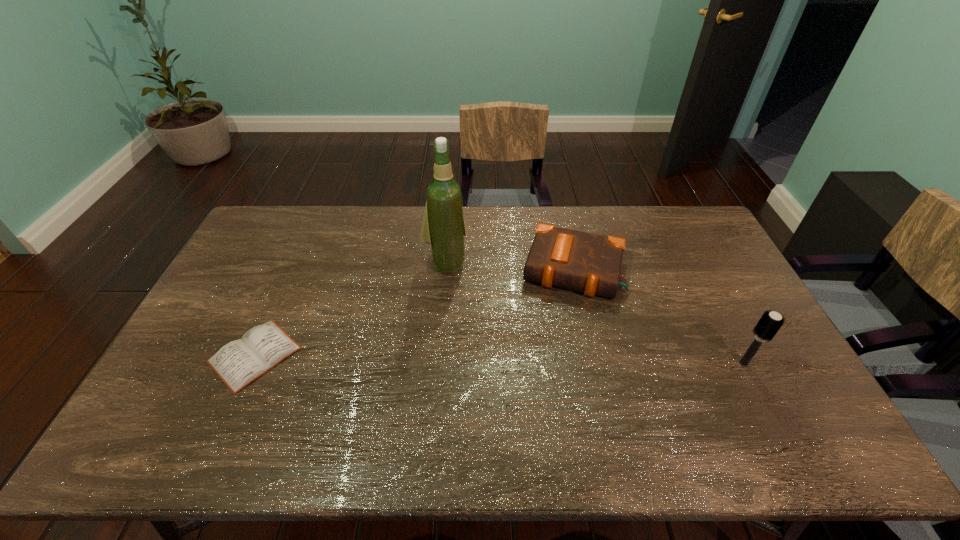
At what (x,y) coordinates should I click in order to perform the action: click on object present at the near left corner. Please return your answer as a coordinate pair (x, y). Looking at the image, I should click on (238, 363).

Where is `vacant space at the far edge of the desktop`? This screenshot has height=540, width=960. vacant space at the far edge of the desktop is located at coordinates (365, 211).

In the image, there is a desktop. At what (x,y) coordinates should I click in order to perform the action: click on vacant space at the near edge. Please return your answer as a coordinate pair (x, y). Looking at the image, I should click on (615, 394).

Image resolution: width=960 pixels, height=540 pixels. I want to click on vacant space at the left edge of the desktop, so click(228, 277).

In the image, there is a desktop. Where is `vacant space at the right edge`? This screenshot has width=960, height=540. vacant space at the right edge is located at coordinates (760, 360).

Where is `vacant space at the far right corner of the desktop`? Image resolution: width=960 pixels, height=540 pixels. vacant space at the far right corner of the desktop is located at coordinates (662, 206).

Where is `empty space between the diary and the wine bottle`? This screenshot has height=540, width=960. empty space between the diary and the wine bottle is located at coordinates (350, 309).

In order to click on free point between the diary and the Bible in this screenshot , I will do pyautogui.click(x=414, y=312).

In order to click on blank region between the third object from right to left and the diary in this screenshot , I will do `click(350, 309)`.

You are a GUI agent. You are given a task and a screenshot of the screen. Output one action in this format:
    pyautogui.click(x=<x>, y=<y>)
    Task: Click on the free space that is in between the second object from left to right and the Bible
    This screenshot has height=540, width=960.
    Given the screenshot: What is the action you would take?
    pyautogui.click(x=510, y=266)